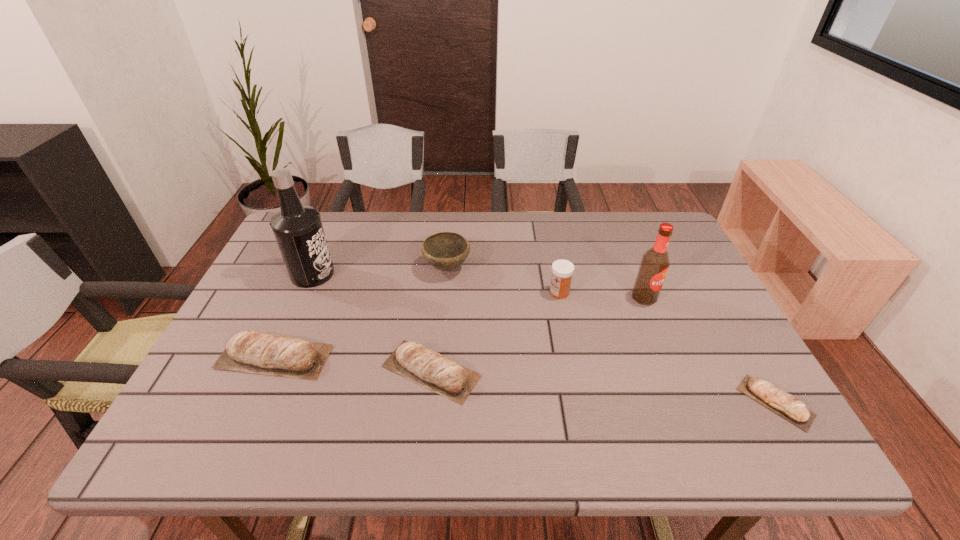
This screenshot has height=540, width=960. What are the coordinates of `object that is the fifth closest to the bowl` in the screenshot? It's located at [654, 265].

Select which object is the closest to the third object from right to left. Please provide its 2D coordinates. Your answer should be formatted as a tuple, i.e. [(x, y)], where the tuple contains the x and y coordinates of a point satisfying the conditions above.

[(654, 265)]

Select which pita bread appears as the second closest to the shortest object. Please provide its 2D coordinates. Your answer should be formatted as a tuple, i.e. [(x, y)], where the tuple contains the x and y coordinates of a point satisfying the conditions above.

[(270, 355)]

Select which pita bread appears as the second closest to the liquor. Please provide its 2D coordinates. Your answer should be formatted as a tuple, i.e. [(x, y)], where the tuple contains the x and y coordinates of a point satisfying the conditions above.

[(412, 360)]

Where is `free location that satisfies the following two spatial constraints: 1. on the front side of the bowl; 2. on the right side of the third object from right to left`? This screenshot has width=960, height=540. free location that satisfies the following two spatial constraints: 1. on the front side of the bowl; 2. on the right side of the third object from right to left is located at coordinates (444, 292).

Find the location of a particular element. vacant position in the image that satisfies the following two spatial constraints: 1. on the front label of the fifth object from left to right; 2. on the right side of the tallest object is located at coordinates (304, 292).

Find the location of a particular element. The height and width of the screenshot is (540, 960). blank area in the image that satisfies the following two spatial constraints: 1. on the front label of the second pita bread from left to right; 2. on the left side of the liquor is located at coordinates (270, 371).